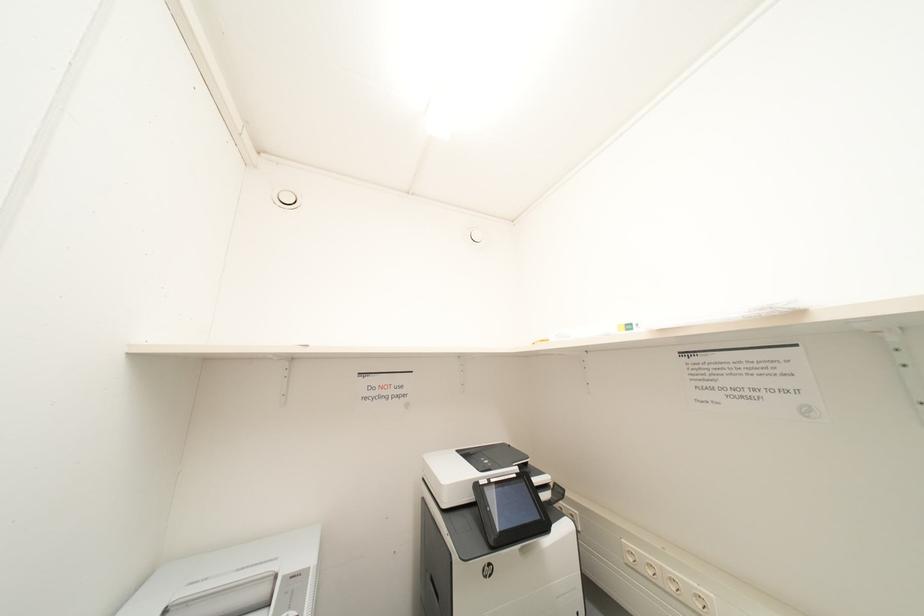
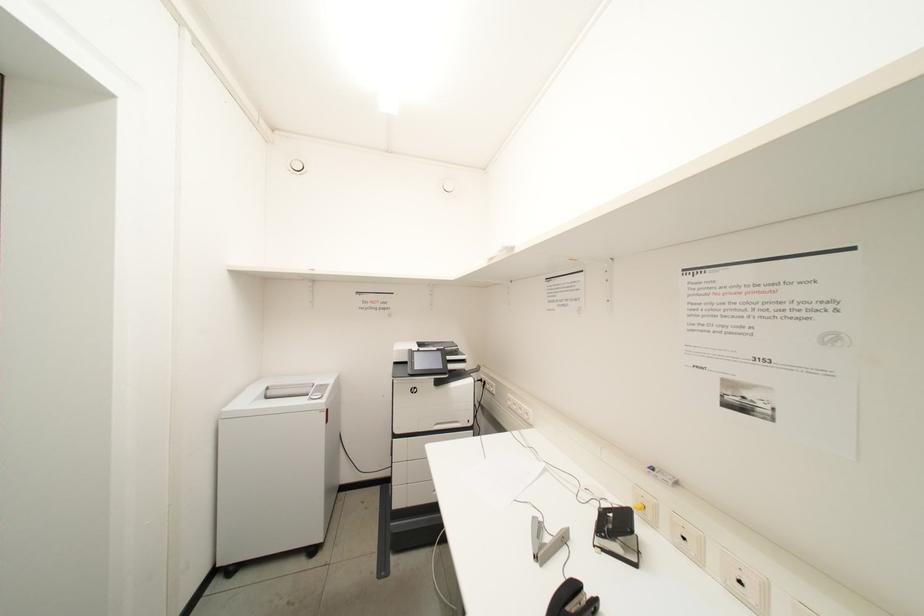
Question: Based on the continuous images, in which direction is the camera rotating? Reply with the corresponding letter.

Choices:
 (A) Left
 (B) Right
 (C) Up
 (D) Down

Answer: (D)